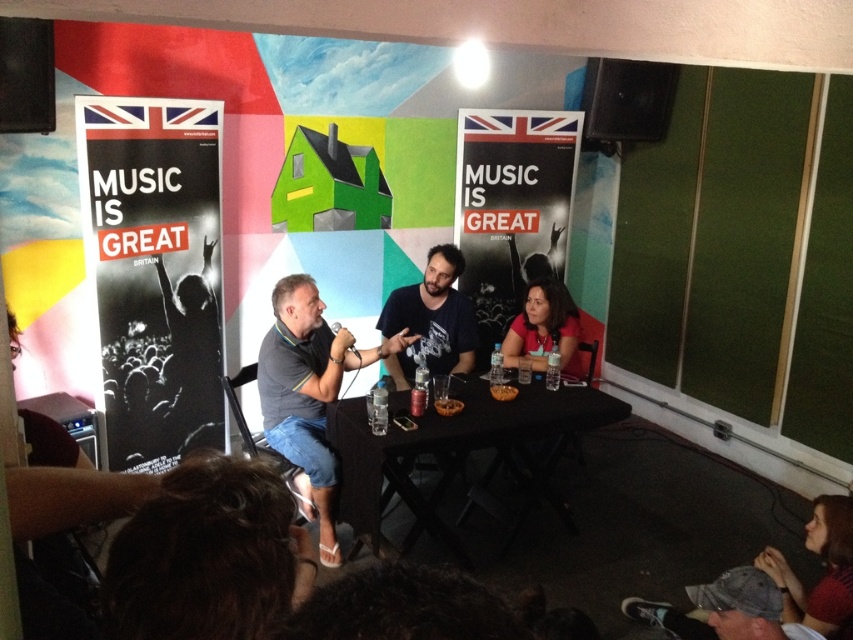
Can you confirm if matte black poster at center is positioned below matte red shirt at center?

Incorrect, matte black poster at center is not positioned below matte red shirt at center.

Is matte black poster at center in front of matte red shirt at center?

That is True.

Measure the distance between matte black poster at center and camera.

A distance of 3.24 meters exists between matte black poster at center and camera.

Where is `matte black poster at center`? The width and height of the screenshot is (853, 640). matte black poster at center is located at coordinates (256, 170).

Is black plastic table at center bigger than translucent plastic cup at table center?

Indeed, black plastic table at center has a larger size compared to translucent plastic cup at table center.

Can you confirm if black plastic table at center is wider than translucent plastic cup at table center?

Yes, black plastic table at center is wider than translucent plastic cup at table center.

Does point (543, 451) lie in front of point (412, 388)?

No, it is not.

Find the location of a particular element. The height and width of the screenshot is (640, 853). black plastic table at center is located at coordinates (457, 452).

Is black paper poster at left shorter than gray fabric shirt at center?

Incorrect, black paper poster at left's height does not fall short of gray fabric shirt at center's.

Is black paper poster at left to the right of gray fabric shirt at center from the viewer's perspective?

Incorrect, black paper poster at left is not on the right side of gray fabric shirt at center.

You are a GUI agent. You are given a task and a screenshot of the screen. Output one action in this format:
    pyautogui.click(x=<x>, y=<y>)
    Task: Click on the black paper poster at left
    
    Given the screenshot: What is the action you would take?
    pyautogui.click(x=154, y=272)